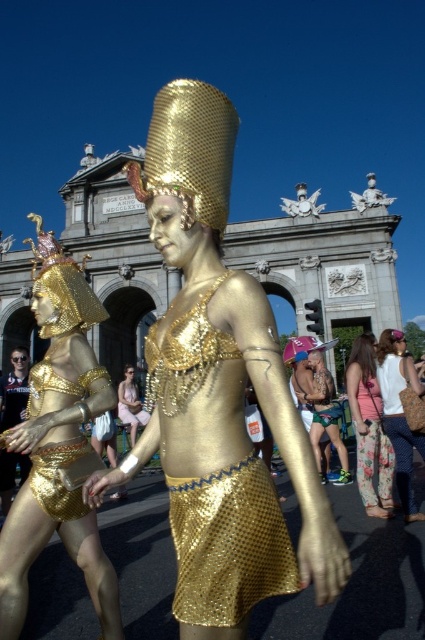
You are a photographer setting up for a photoshoot. You need to ensure that the gold metallic headdress at center and the floral fabric dress at lower right are both visible in the frame. Based on their positions and sizes, which object should you prioritize positioning closer to the camera to ensure it doesn

The gold metallic headdress at center should be positioned closer to the camera because it might be wider than the floral fabric dress at lower right, ensuring it remains visible without being cropped out.

You are a costume designer preparing for a performance. You need to determine which costume component occupies more space visually in the scene. Based on the image, which is larger in size between the floral fabric pants at lower right and the matte gold fabric dress at center?

The floral fabric pants at lower right is bigger than the matte gold fabric dress at center, so the floral fabric pants at lower right occupies more visual space in the scene.

You are standing at the origin point in the image. Which of the two points, point (x=371, y=396) or point (x=121, y=412), is closer to you?

Point (x=371, y=396) is in front of point (x=121, y=412), so it is closer to you.